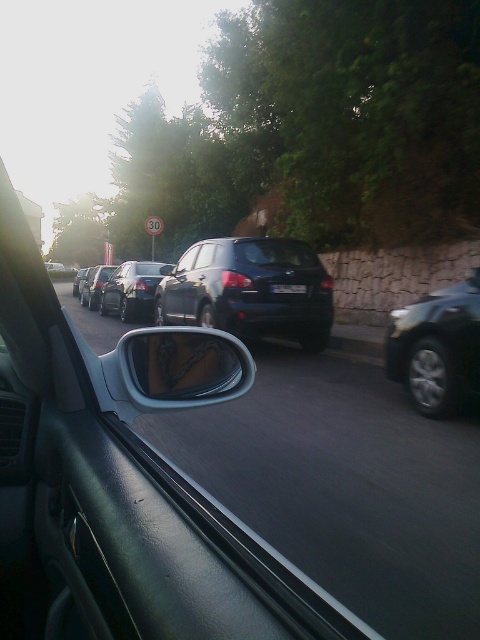
Question: Observing the image, what is the correct spatial positioning of satin black car at right in reference to satin black sedan at center?

Choices:
 (A) above
 (B) below

Answer: (B)

Question: Can you confirm if satin black car at right is positioned above black plastic license plate at center?

Choices:
 (A) no
 (B) yes

Answer: (A)

Question: Which is nearer to the glossy plastic car mirror at center?

Choices:
 (A) matte black hatchback at center
 (B) satin black car at right

Answer: (B)

Question: Among these points, which one is nearest to the camera?

Choices:
 (A) (284, 292)
 (B) (100, 268)
 (C) (163, 300)

Answer: (A)

Question: Among these points, which one is nearest to the camera?

Choices:
 (A) (445, 384)
 (B) (109, 289)
 (C) (296, 289)

Answer: (A)

Question: In this image, where is shiny silver sedan at center located relative to black plastic license plate at center?

Choices:
 (A) left
 (B) right

Answer: (A)